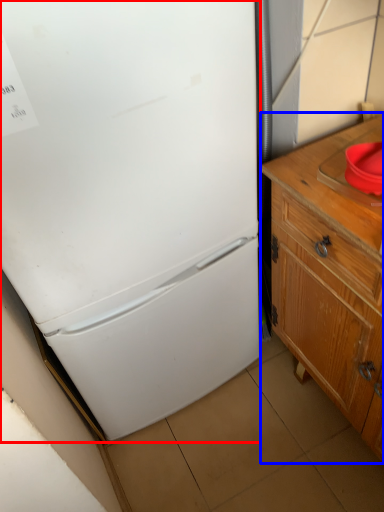
Question: Which of the following is the farthest to the observer, refrigerator (highlighted by a red box) or cabinetry (highlighted by a blue box)?

Choices:
 (A) refrigerator
 (B) cabinetry

Answer: (B)